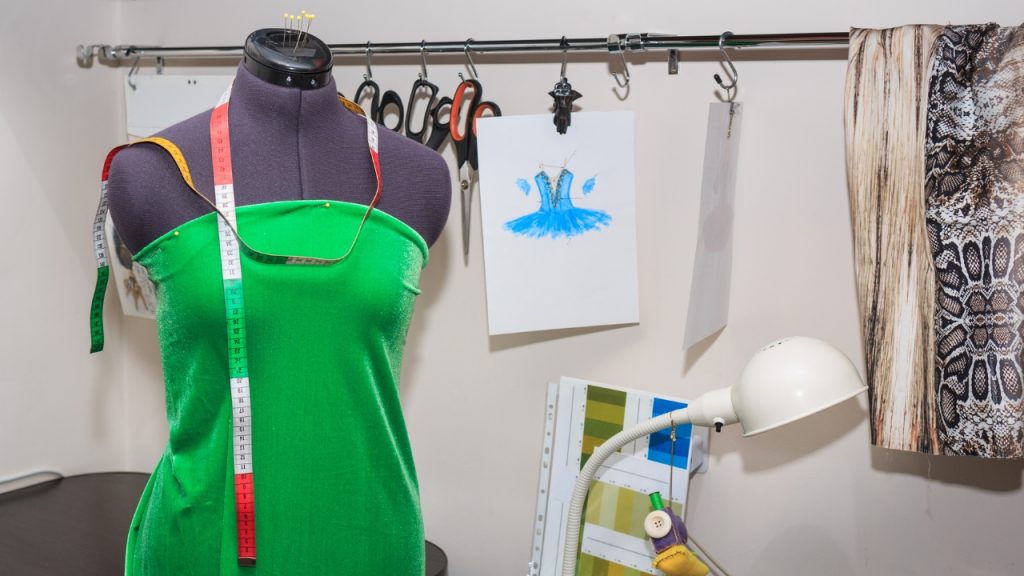
Point out all instances of what holds the shelf up in the image. Your answer should be formatted as a list of tuples, i.e. [(x1, y1), (x2, y2), ...], where each tuple contains the x and y coordinates of a point satisfying the conditions above.

[(158, 71), (674, 58)]